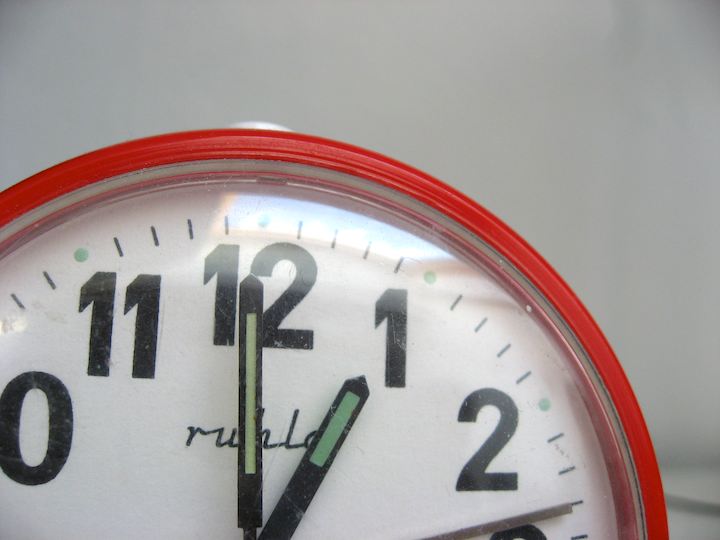
In order to click on white wall in this screenshot , I will do point(571,122).